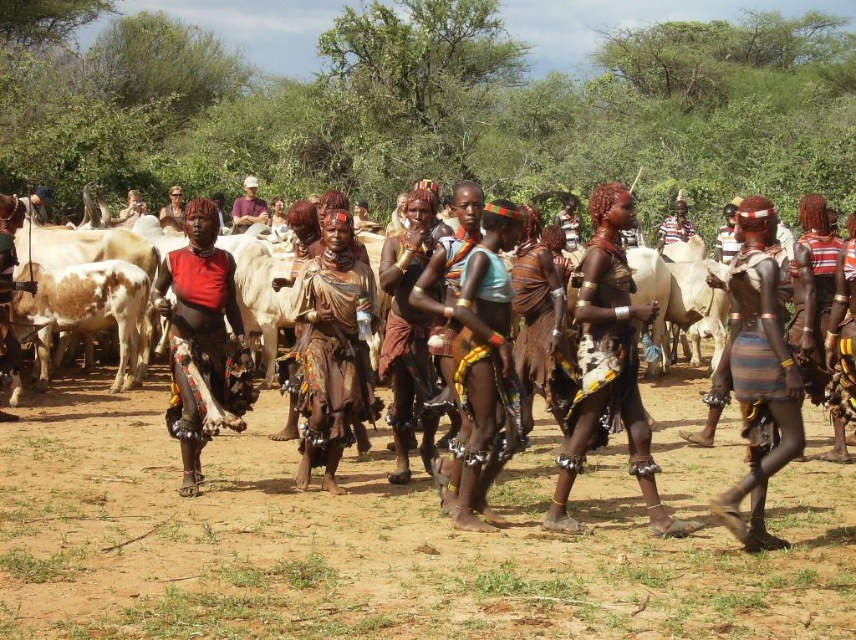
You are a photographer standing at the edge of the scene. You want to capture a photo that includes both the brown sandy ground at center and the brown leather skirt at center. Given that your camera has a maximum focus range of 6 feet, will you be able to capture both objects in focus without moving your position?

The distance between the brown sandy ground at center and the brown leather skirt at center is 6.79 feet. Since your camera can only focus up to 6 feet, you won t be able to capture both objects in focus without moving your position.

You are a photographer standing at the edge of the scene. You want to capture the textured fabric dress at center in your photo. What is the exact coordinate where you should focus your camera?

The textured fabric dress at center is located at coordinate point (687, 490), so you should focus your camera there to capture it.

You are a photographer standing at the center of the scene. You want to capture a closeup of the black leather skirt at center. Which direction should you move to get closer to it?

The black leather skirt at center is already at the center of the scene, so you don not need to move to capture it. Just adjust your camera focus.